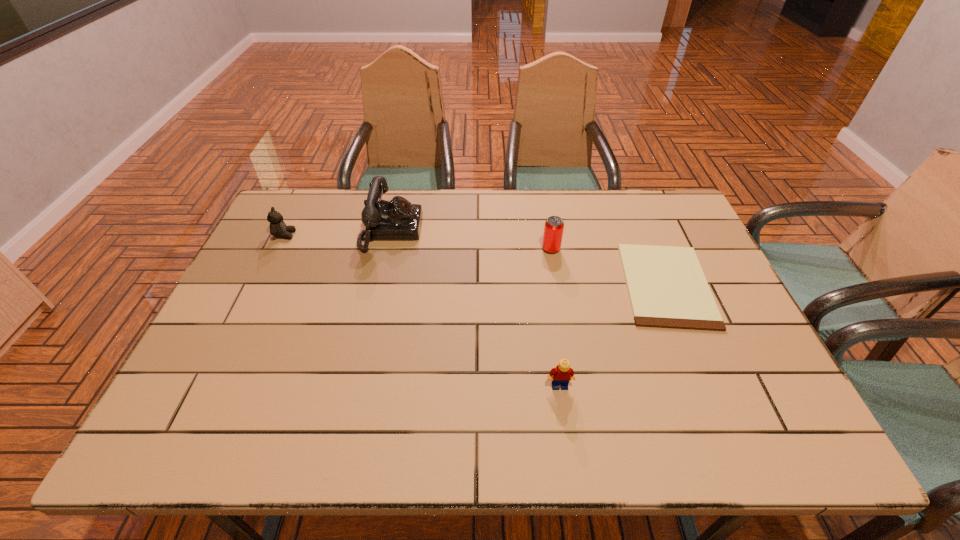
Image resolution: width=960 pixels, height=540 pixels. Identify the location of the tallest object. (397, 219).

The height and width of the screenshot is (540, 960). Identify the location of telephone. (397, 219).

Where is `can`? can is located at coordinates (553, 230).

I want to click on teddy bear, so pyautogui.click(x=278, y=228).

Locate an element on the screen. The width and height of the screenshot is (960, 540). the nearest object is located at coordinates (561, 375).

You are a GUI agent. You are given a task and a screenshot of the screen. Output one action in this format:
    pyautogui.click(x=<x>, y=<y>)
    Task: Click on the clipboard
    
    Given the screenshot: What is the action you would take?
    pos(667,288)

The image size is (960, 540). In order to click on the shortest object in this screenshot , I will do `click(667, 288)`.

This screenshot has height=540, width=960. What are the coordinates of `vacant point located 0.280m on the dial of the second object from left to right` in the screenshot? It's located at (509, 231).

Image resolution: width=960 pixels, height=540 pixels. In order to click on free space located 0.350m on the front of the can in this screenshot , I will do `click(568, 351)`.

Locate an element on the screen. This screenshot has height=540, width=960. vacant space located on the face of the leftmost object is located at coordinates (349, 235).